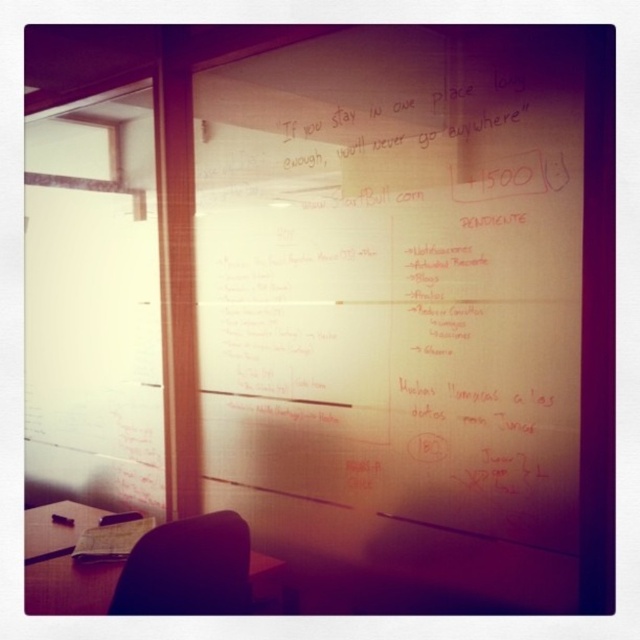
Is brown wooden table at lower left above wooden table at lower left?

No.

Does brown wooden table at lower left come in front of wooden table at lower left?

Yes, brown wooden table at lower left is closer to the viewer.

Who is more forward, (250,579) or (32,540)?

Point (250,579) is more forward.

Identify the location of brown wooden table at lower left. (64, 563).